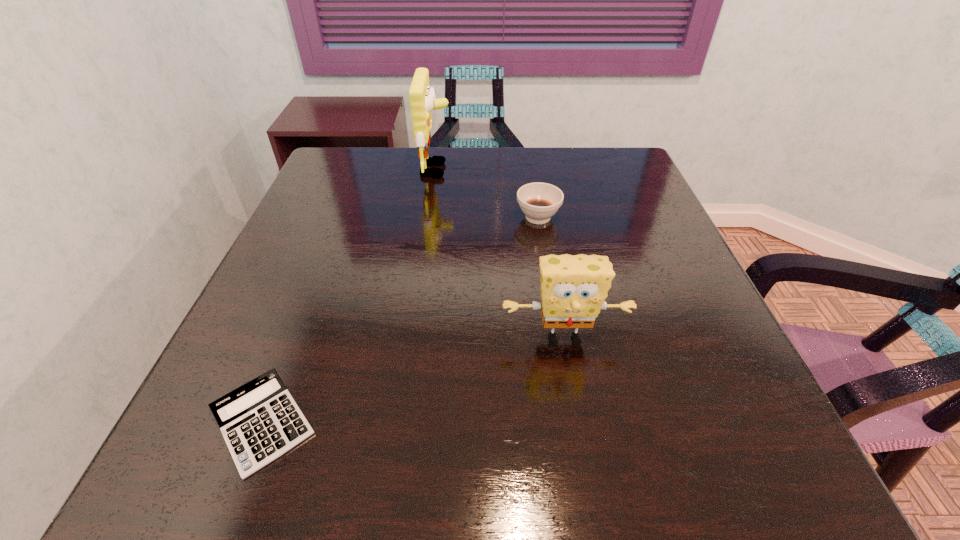
Locate an element on the screen. Image resolution: width=960 pixels, height=540 pixels. vacant region between the farthest object and the right sponge is located at coordinates (500, 254).

The height and width of the screenshot is (540, 960). I want to click on empty space that is in between the soup bowl and the leftmost object, so click(x=400, y=320).

Locate which object is the second closest to the nearer sponge. Please provide its 2D coordinates. Your answer should be formatted as a tuple, i.e. [(x, y)], where the tuple contains the x and y coordinates of a point satisfying the conditions above.

[(260, 421)]

Where is `object that is the second nearest to the right sponge`? This screenshot has width=960, height=540. object that is the second nearest to the right sponge is located at coordinates (260, 421).

Identify the location of vacant point that satisfies the following two spatial constraints: 1. on the face of the taller sponge; 2. on the left side of the second farthest object. This screenshot has width=960, height=540. (429, 217).

This screenshot has height=540, width=960. Find the location of `free space in the image that satisfies the following two spatial constraints: 1. on the face of the taller sponge; 2. on the left side of the soup bowl`. free space in the image that satisfies the following two spatial constraints: 1. on the face of the taller sponge; 2. on the left side of the soup bowl is located at coordinates (429, 217).

In order to click on free space that satisfies the following two spatial constraints: 1. on the back side of the soup bowl; 2. on the face of the farthest object in this screenshot , I will do `click(530, 170)`.

Find the location of a particular element. vacant position in the image that satisfies the following two spatial constraints: 1. on the face of the third object from right to left; 2. on the front side of the leftmost object is located at coordinates (400, 422).